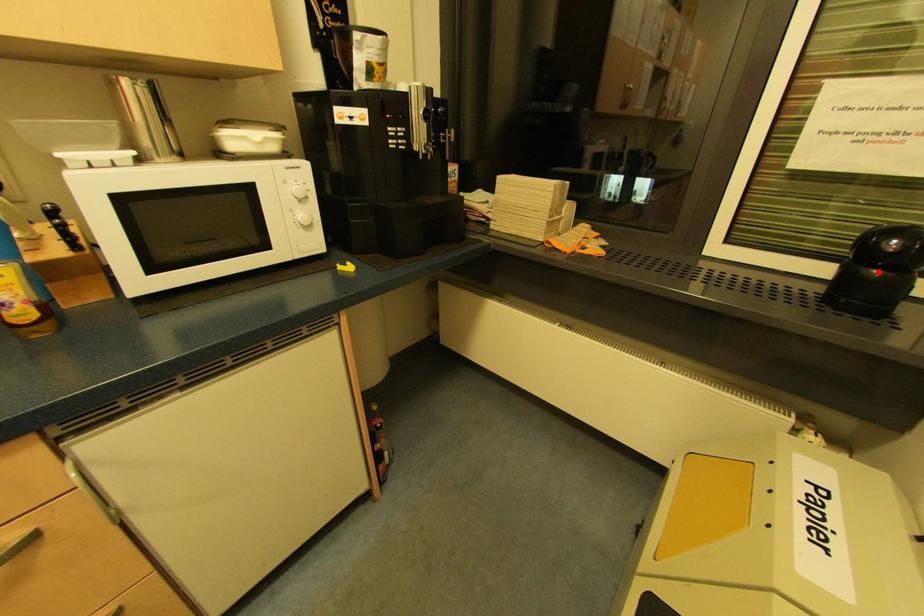
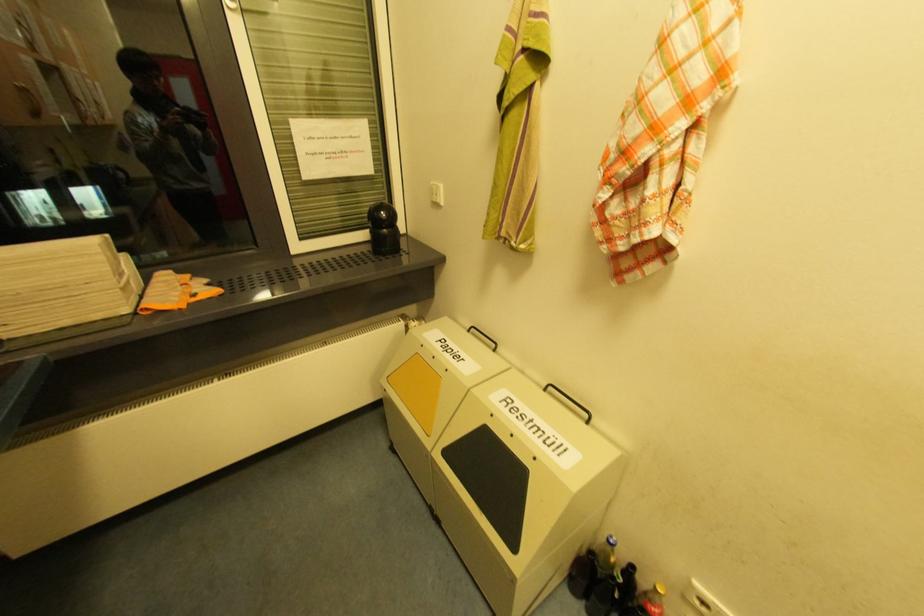
Question: I am providing you with two images of the same scene from different viewpoints. A red point is shown in image1. For the corresponding object point in image2, is it positioned nearer or farther from the camera?

Choices:
 (A) Nearer
 (B) Farther

Answer: (A)